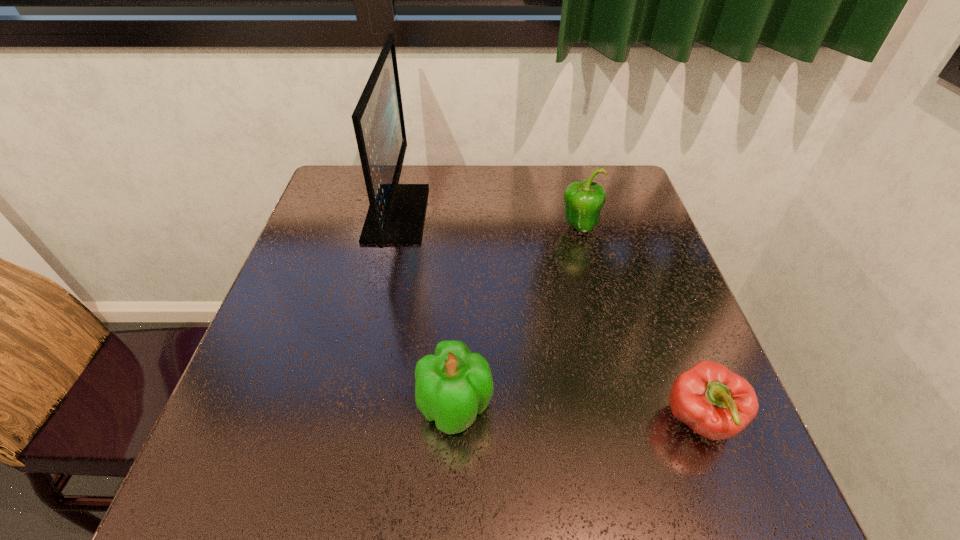
Where is `free location that satisfies the following two spatial constraints: 1. on the screen side of the tallest object; 2. on the right side of the third object from left to right`? Image resolution: width=960 pixels, height=540 pixels. free location that satisfies the following two spatial constraints: 1. on the screen side of the tallest object; 2. on the right side of the third object from left to right is located at coordinates tap(394, 227).

Identify the location of vacant space that satisfies the following two spatial constraints: 1. on the screen side of the shortest object; 2. on the left side of the monitor. pos(351,421).

What are the coordinates of `vacant area that satisfies the following two spatial constraints: 1. on the screen side of the tallest object; 2. on the back side of the farthest bell pepper` in the screenshot? It's located at (394, 227).

This screenshot has height=540, width=960. I want to click on vacant area that satisfies the following two spatial constraints: 1. on the screen side of the leftmost object; 2. on the right side of the third object from left to right, so click(x=394, y=227).

Where is `free location that satisfies the following two spatial constraints: 1. on the back side of the third object from right to left; 2. on the left side of the farthest bell pepper`? The image size is (960, 540). free location that satisfies the following two spatial constraints: 1. on the back side of the third object from right to left; 2. on the left side of the farthest bell pepper is located at coordinates (464, 227).

Locate an element on the screen. The height and width of the screenshot is (540, 960). free space that satisfies the following two spatial constraints: 1. on the screen side of the second bell pepper from right to left; 2. on the right side of the leftmost object is located at coordinates (394, 227).